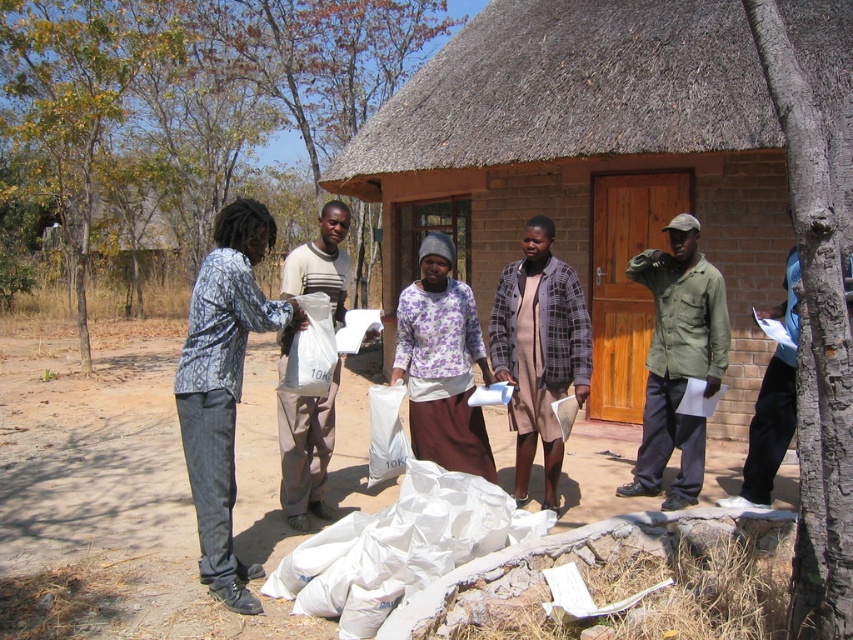
Question: Does patterned fabric shirt at center appear over purple floral shirt at center?

Choices:
 (A) no
 (B) yes

Answer: (B)

Question: Can you confirm if thatched roof hut at center is positioned to the left of white matte bag at center?

Choices:
 (A) no
 (B) yes

Answer: (A)

Question: Among these points, which one is farthest from the camera?

Choices:
 (A) (384, 614)
 (B) (483, 307)
 (C) (378, 432)

Answer: (B)

Question: Is thatched roof hut at center above matte green shirt at center?

Choices:
 (A) yes
 (B) no

Answer: (A)

Question: Which object is the closest to the patterned fabric shirt at center?

Choices:
 (A) thatched roof hut at center
 (B) white matte bag at center
 (C) light brown cotton shirt at center
 (D) purple floral shirt at center

Answer: (C)

Question: Among these objects, which one is nearest to the camera?

Choices:
 (A) thatched roof hut at center
 (B) white matte bag at center
 (C) purple floral shirt at center

Answer: (B)